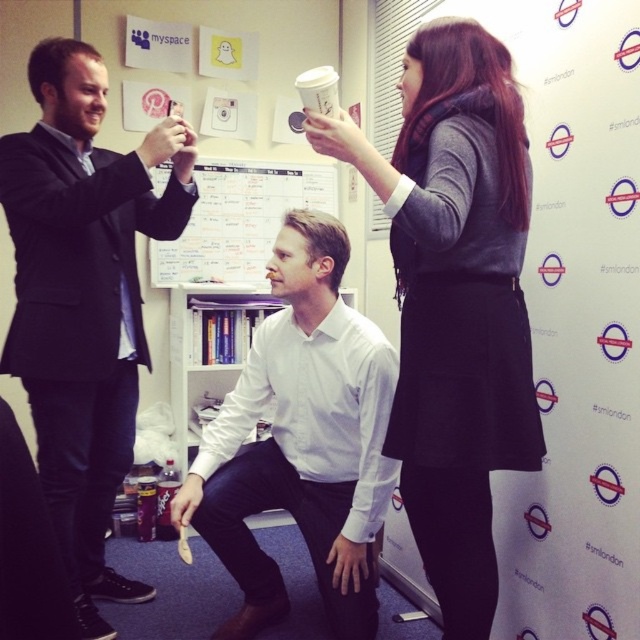
You are standing in the office scene and want to hand a document to both the dark gray sweater at upper center and the white smooth shirt at center. Which person should you approach first based on their proximity to you?

You should approach the dark gray sweater at upper center first because it is closer to you than the white smooth shirt at center.

You are standing at the origin point of the coordinate system in this office scene. You need to walk to the point labeled point (461, 404) first and then to point (80, 353). Which direction should you face first to reach both points in order?

First, you should face the direction of point (461, 404), which is in front of point (80, 353). After reaching the first point, turn around to face the opposite direction to reach the second point.